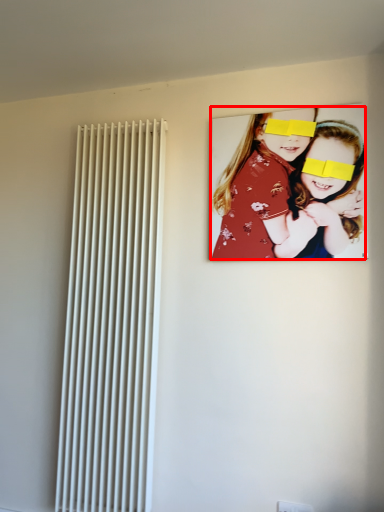
Question: From the image's perspective, considering the relative positions of girl (annotated by the red box) and radiator in the image provided, where is girl (annotated by the red box) located with respect to the staircase?

Choices:
 (A) below
 (B) above

Answer: (B)